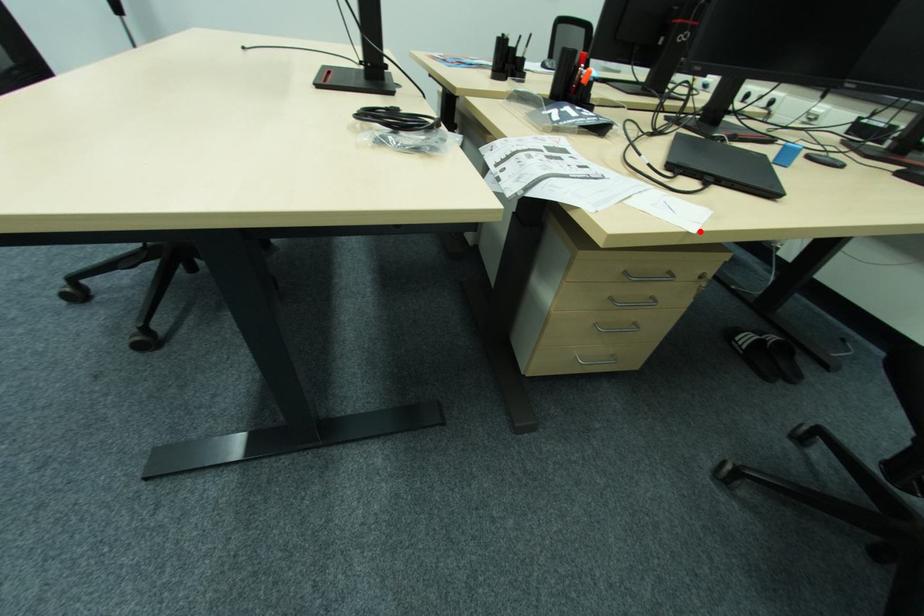
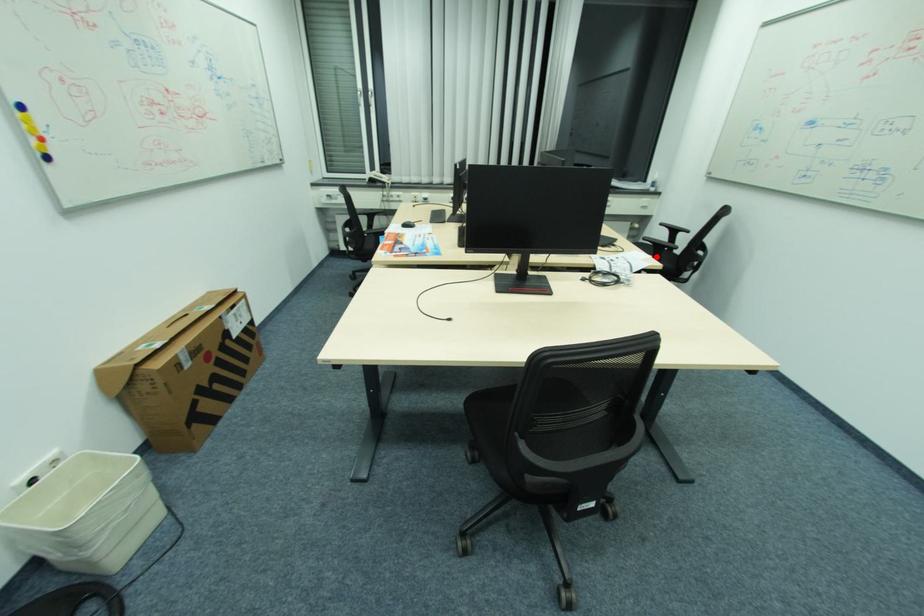
I am providing you with two images of the same scene from different viewpoints. A red point is marked on the first image and another point is marked on the second image. Is the marked point in image1 the same physical position as the marked point in image2?

Yes